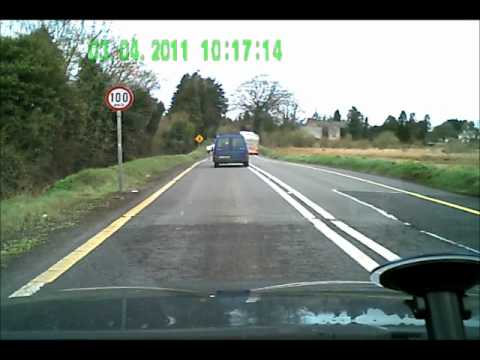
Image resolution: width=480 pixels, height=360 pixels. I want to click on suction cup, so click(x=415, y=279).